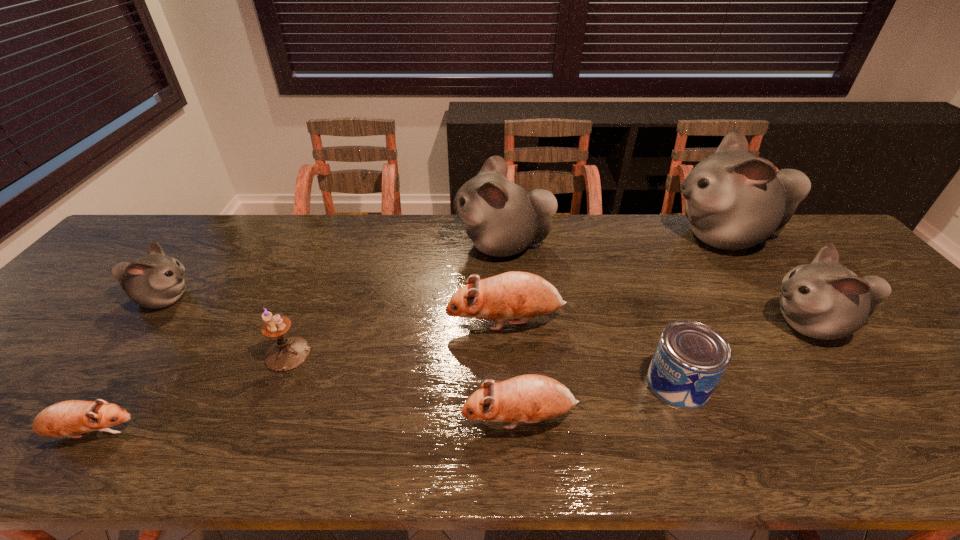
Identify the location of the third closest object to the second smallest white hamster. The image size is (960, 540). (511, 295).

Find the location of a particular element. This screenshot has width=960, height=540. object that is the eighth closest to the third object from left to right is located at coordinates (824, 300).

Locate an element on the screen. The image size is (960, 540). hamster that is the second closest to the seventh object from left to right is located at coordinates (531, 398).

Image resolution: width=960 pixels, height=540 pixels. Find the location of `the second closest hamster to the third biggest white hamster`. the second closest hamster to the third biggest white hamster is located at coordinates (511, 295).

Where is `the third closest white hamster to the second tallest hamster`? the third closest white hamster to the second tallest hamster is located at coordinates (154, 281).

At what (x,y) coordinates should I click in order to perform the action: click on the second closest white hamster to the eighth shortest object. Please return your answer as a coordinate pair (x, y). The height and width of the screenshot is (540, 960). Looking at the image, I should click on (824, 300).

The width and height of the screenshot is (960, 540). What are the coordinates of `the second closest brown hamster relative to the tallest hamster` in the screenshot? It's located at (531, 398).

Where is `the closest brown hamster to the second shortest hamster`? This screenshot has width=960, height=540. the closest brown hamster to the second shortest hamster is located at coordinates (511, 295).

I want to click on free spot that satisfies the following two spatial constraints: 1. on the face of the leftmost white hamster; 2. on the right side of the purple candle holder, so click(x=121, y=354).

In order to click on free space that satisfies the following two spatial constraints: 1. on the front side of the third object from left to right; 2. at the face of the leftmost brown hamster in this screenshot , I will do `click(255, 434)`.